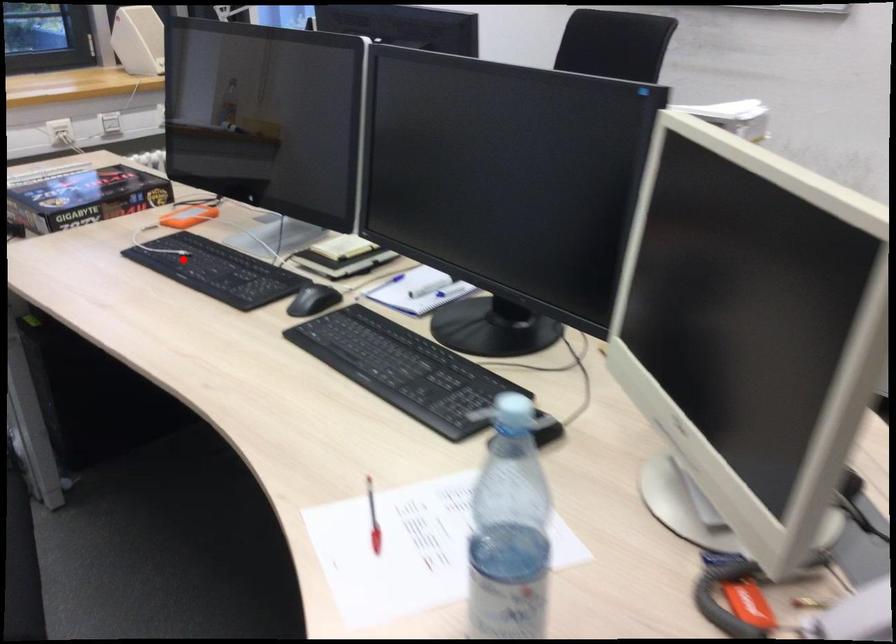
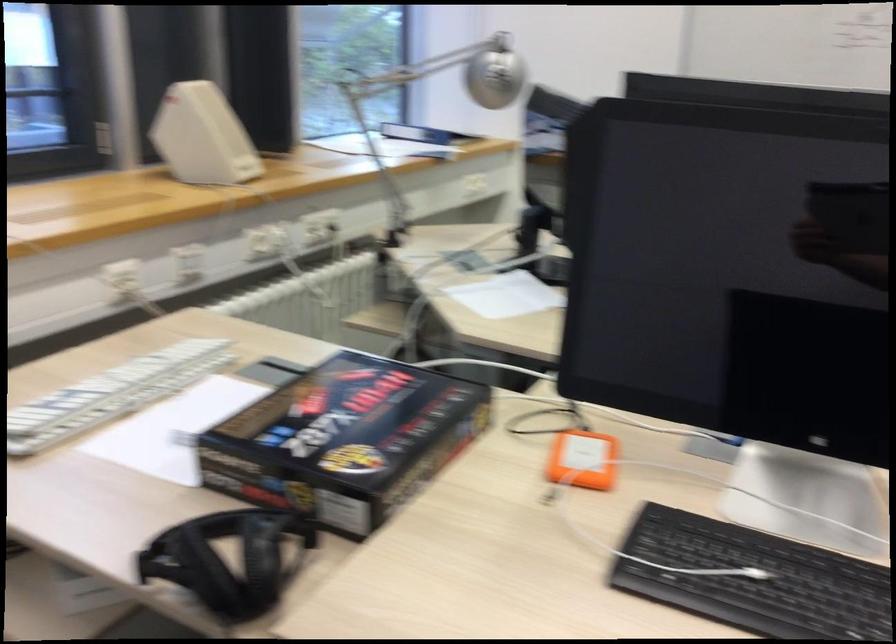
Where in the second image is the point corresponding to the highlighted location from the first image?

(754, 579)